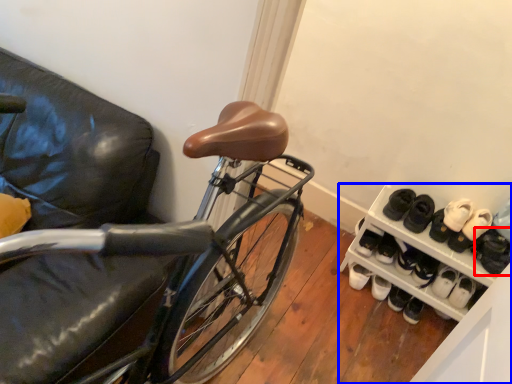
Question: Among these objects, which one is farthest to the camera, footwear (highlighted by a red box) or cabinetry (highlighted by a blue box)?

Choices:
 (A) footwear
 (B) cabinetry

Answer: (A)